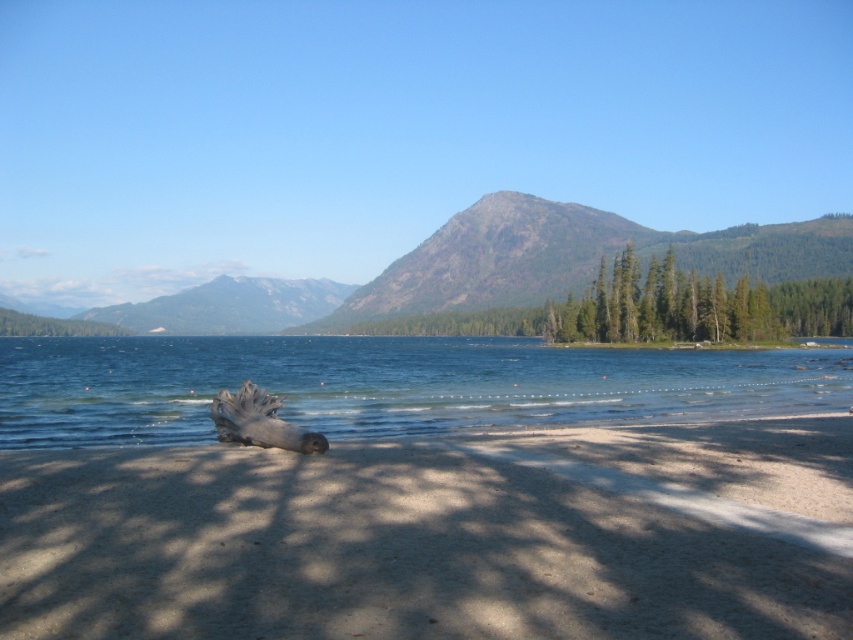
Question: Is the position of clear water at beach center more distant than that of green textured trees at center?

Choices:
 (A) yes
 (B) no

Answer: (B)

Question: Which of these objects is positioned farthest from the green textured trees at center?

Choices:
 (A) brown sandy beach at lower center
 (B) clear water at beach center

Answer: (A)

Question: Is clear water at beach center below green textured trees at center?

Choices:
 (A) no
 (B) yes

Answer: (B)

Question: Which is farther from the green textured trees at center?

Choices:
 (A) green textured mountain at center
 (B) brown sandy beach at lower center
 (C) clear water at beach center

Answer: (B)

Question: Does clear water at beach center appear under green textured trees at center?

Choices:
 (A) no
 (B) yes

Answer: (B)

Question: Considering the real-world distances, which object is farthest from the clear water at beach center?

Choices:
 (A) green textured trees at center
 (B) green textured mountain at center
 (C) brown sandy beach at lower center

Answer: (B)